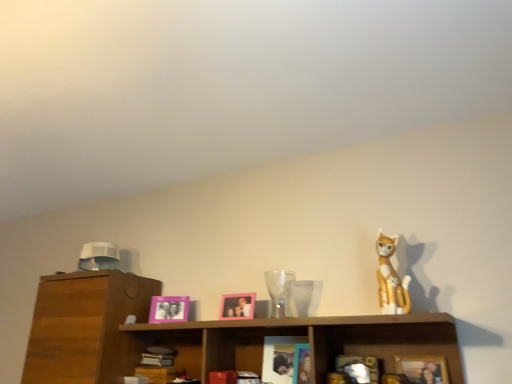
Question: Which direction should I rotate to look at pink plastic picture frame at center, the 1th picture frame from the back?

Choices:
 (A) right
 (B) left

Answer: (B)

Question: Is pink plastic picture frame at center, the third picture frame positioned from the right, wider than pink plastic picture frame at center, which appears as the 2th picture frame when viewed from the front?

Choices:
 (A) yes
 (B) no

Answer: (A)

Question: From a real-world perspective, is pink plastic picture frame at center, the 1th picture frame from the back, on pink plastic picture frame at center, which appears as the 2th picture frame when viewed from the front?

Choices:
 (A) yes
 (B) no

Answer: (B)

Question: Can pink plastic picture frame at center, which appears as the 2th picture frame when viewed from the front, be found inside pink plastic picture frame at center, which is the third picture frame in front-to-back order?

Choices:
 (A) no
 (B) yes

Answer: (A)

Question: From the image's perspective, is pink plastic picture frame at center, which is the third picture frame in front-to-back order, over pink plastic picture frame at center, which appears as the 2th picture frame when viewed from the front?

Choices:
 (A) yes
 (B) no

Answer: (B)

Question: Is pink plastic picture frame at center, the third picture frame positioned from the right, positioned behind pink plastic picture frame at center, the second picture frame when ordered from left to right?

Choices:
 (A) yes
 (B) no

Answer: (A)

Question: Is pink plastic picture frame at center, the 1th picture frame from the back, oriented away from pink plastic picture frame at center, which appears as the 2th picture frame when viewed from the front?

Choices:
 (A) no
 (B) yes

Answer: (A)

Question: Can we say pink plastic picture frame at center, arranged as the 2th picture frame when viewed from the back, lies outside transparent glass vase at center?

Choices:
 (A) no
 (B) yes

Answer: (B)

Question: Is pink plastic picture frame at center, arranged as the 2th picture frame when viewed from the back, further to the viewer compared to transparent glass vase at center?

Choices:
 (A) no
 (B) yes

Answer: (B)

Question: Can you confirm if pink plastic picture frame at center, which ranks as the second picture frame in right-to-left order, is thinner than transparent glass vase at center?

Choices:
 (A) yes
 (B) no

Answer: (A)

Question: Could you tell me if pink plastic picture frame at center, arranged as the 2th picture frame when viewed from the back, is facing transparent glass vase at center?

Choices:
 (A) yes
 (B) no

Answer: (B)

Question: Can transparent glass vase at center be found inside pink plastic picture frame at center, the second picture frame when ordered from left to right?

Choices:
 (A) yes
 (B) no

Answer: (B)

Question: Does pink plastic picture frame at center, arranged as the 2th picture frame when viewed from the back, have a greater height compared to transparent glass vase at center?

Choices:
 (A) no
 (B) yes

Answer: (A)

Question: Would you say transparent glass vase at center contains pink plastic picture frame at center, the first picture frame when ordered from left to right?

Choices:
 (A) yes
 (B) no

Answer: (B)